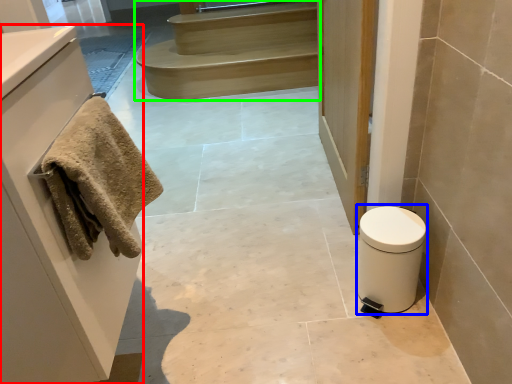
Question: Which object is positioned closest to cabinetry (highlighted by a red box)? Select from toilet bowl (highlighted by a blue box) and stairs (highlighted by a green box).

Choices:
 (A) toilet bowl
 (B) stairs

Answer: (A)